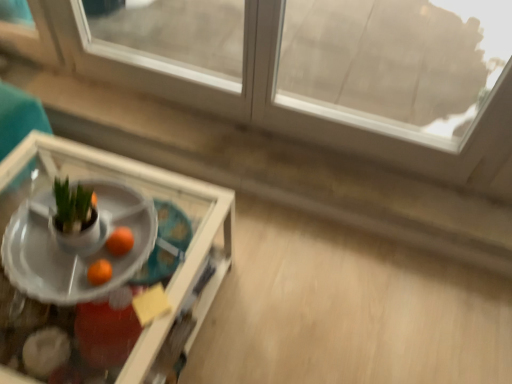
You are a GUI agent. You are given a task and a screenshot of the screen. Output one action in this format:
    pyautogui.click(x=<x>, y=<y>)
    Task: Click on the free point below transparent glass window at upper center (from a real-world perspective)
    
    Given the screenshot: What is the action you would take?
    pyautogui.click(x=254, y=129)